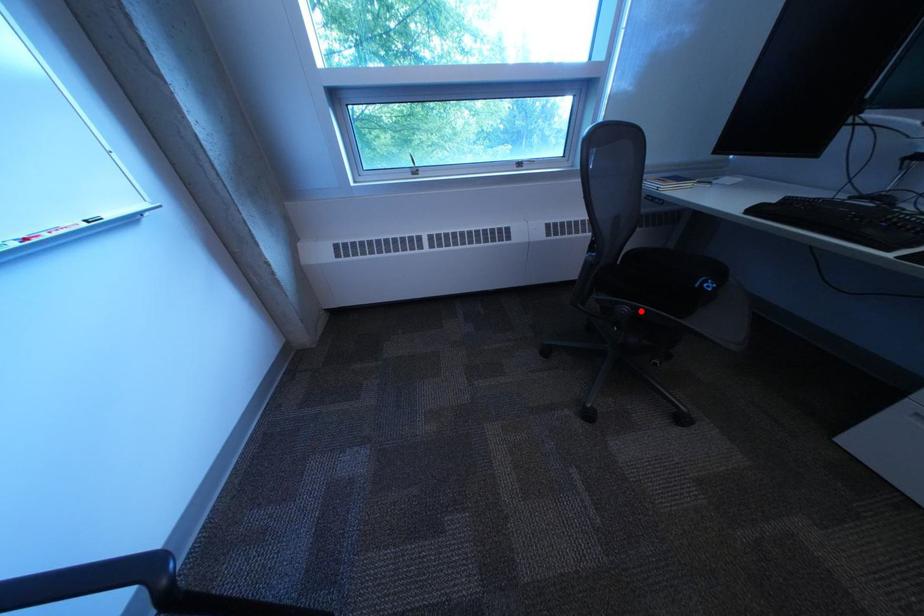
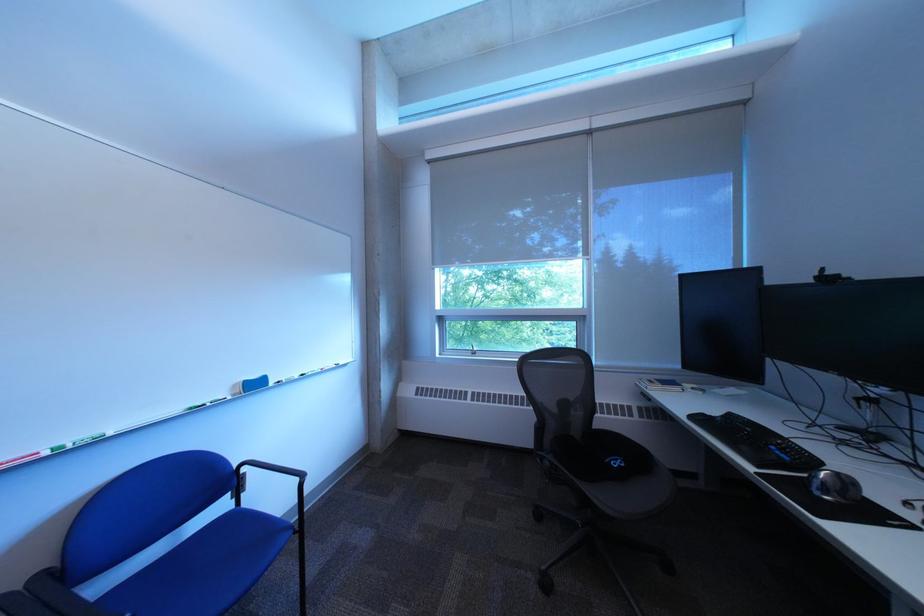
Locate, in the second image, the point that corresponds to the highlighted location in the first image.

(563, 464)